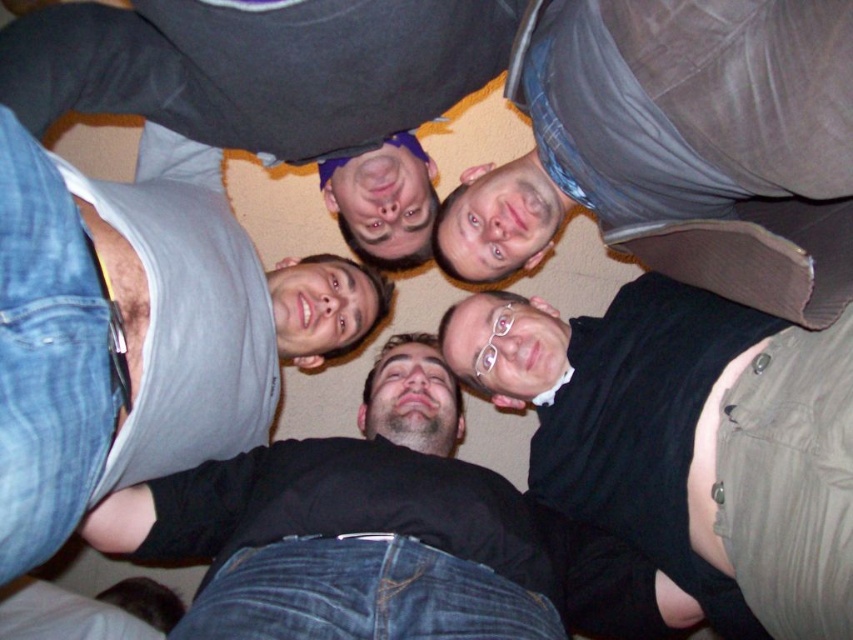
In the scene shown: Is gray fabric tank top at upper left to the left of gray matte tank top at upper center from the viewer's perspective?

Yes, gray fabric tank top at upper left is to the left of gray matte tank top at upper center.

Does gray fabric tank top at upper left have a lesser width compared to gray matte tank top at upper center?

Yes, gray fabric tank top at upper left is thinner than gray matte tank top at upper center.

At what (x,y) coordinates should I click in order to perform the action: click on gray fabric tank top at upper left. Please return your answer as a coordinate pair (x, y). This screenshot has height=640, width=853. Looking at the image, I should click on (134, 337).

This screenshot has width=853, height=640. Find the location of `gray fabric tank top at upper left`. gray fabric tank top at upper left is located at coordinates (134, 337).

How far apart are matte black shirt at upper center and black matte shirt at lower right?

matte black shirt at upper center is 7.60 inches from black matte shirt at lower right.

Is the position of matte black shirt at upper center less distant than that of black matte shirt at lower right?

Yes, matte black shirt at upper center is in front of black matte shirt at lower right.

Between point (816, 205) and point (813, 413), which one is positioned in front?

Point (813, 413) is in front.

The width and height of the screenshot is (853, 640). In order to click on matte black shirt at upper center in this screenshot , I will do `click(677, 147)`.

Is black matte shirt at lower right positioned before gray fabric tank top at upper left?

No, black matte shirt at lower right is further to the viewer.

Does black matte shirt at lower right appear on the left side of gray fabric tank top at upper left?

Incorrect, black matte shirt at lower right is not on the left side of gray fabric tank top at upper left.

Image resolution: width=853 pixels, height=640 pixels. I want to click on black matte shirt at lower right, so click(x=688, y=440).